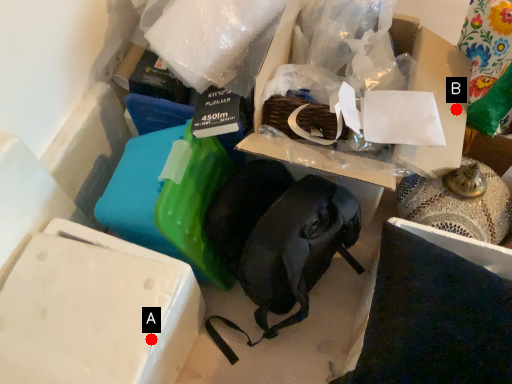
Question: Two points are circled on the image, labeled by A and B beside each circle. Which point appears closest to the camera in this image?

Choices:
 (A) A is closer
 (B) B is closer

Answer: (A)